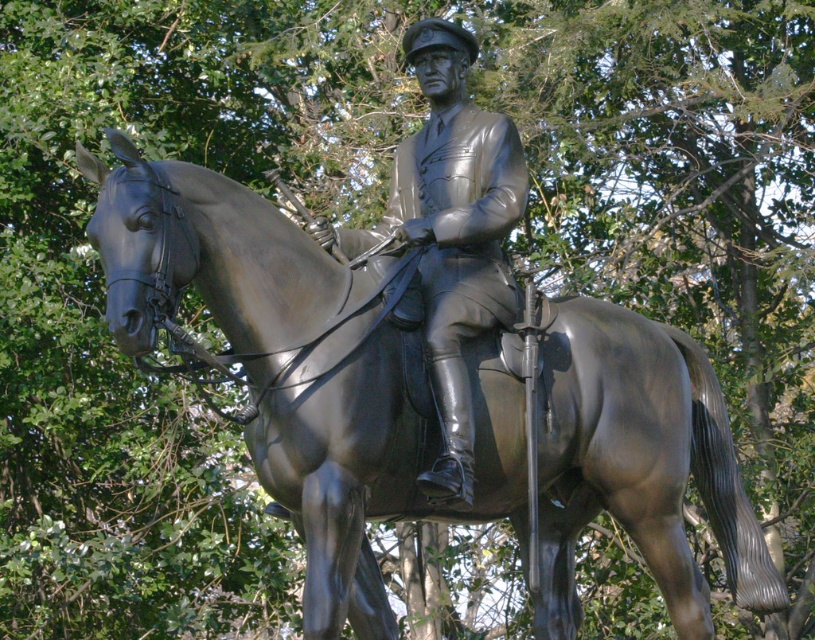
Question: Does shiny bronze horse at center have a greater width compared to polished bronze statue at center?

Choices:
 (A) no
 (B) yes

Answer: (B)

Question: Can you confirm if shiny bronze horse at center is positioned to the right of polished bronze statue at center?

Choices:
 (A) no
 (B) yes

Answer: (A)

Question: Can you confirm if shiny bronze horse at center is thinner than polished bronze statue at center?

Choices:
 (A) yes
 (B) no

Answer: (B)